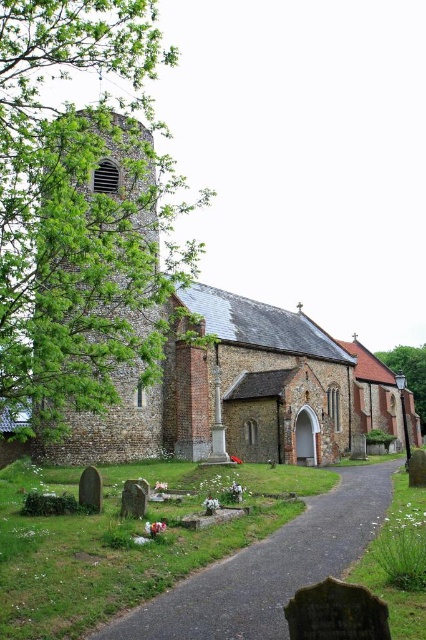
Does gravel pathway at center have a greater height compared to green leafy tree at center?

No, gravel pathway at center is not taller than green leafy tree at center.

Does gravel pathway at center lie behind green leafy tree at center?

No, gravel pathway at center is closer to the viewer.

Looking at this image, who is more forward, (x=265, y=609) or (x=388, y=349)?

Point (x=265, y=609)

This screenshot has height=640, width=426. I want to click on gravel pathway at center, so click(x=267, y=568).

Between point (184, 305) and point (83, 289), which one is positioned behind?

The point (184, 305) is more distant.

Where is `brown brick church at center`? The height and width of the screenshot is (640, 426). brown brick church at center is located at coordinates click(x=233, y=387).

Is point (284, 339) positioned in front of point (94, 161)?

That is False.

Where is `brown brick church at center`? This screenshot has height=640, width=426. brown brick church at center is located at coordinates (233, 387).

Between light brown stone tower at left and gravel pathway at center, which one appears on the right side from the viewer's perspective?

Positioned to the right is gravel pathway at center.

How much distance is there between light brown stone tower at left and gravel pathway at center?

light brown stone tower at left and gravel pathway at center are 25.27 meters apart.

Who is more forward, (57, 456) or (380, 509)?

Positioned in front is point (380, 509).

Identify the location of light brown stone tower at left. This screenshot has height=640, width=426. (101, 308).